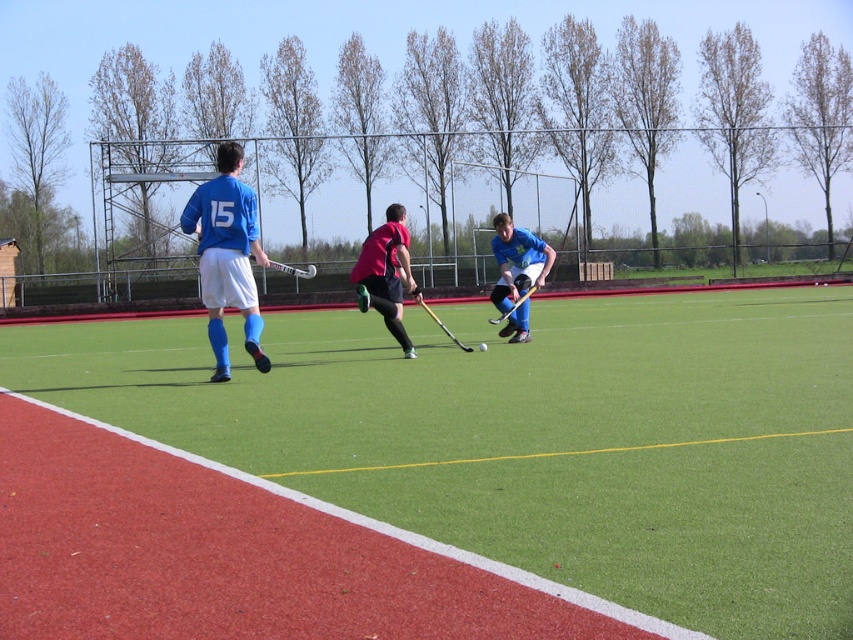
Question: Is matte blue jersey at left bigger than matte black hockey stick at center?

Choices:
 (A) no
 (B) yes

Answer: (B)

Question: Can you confirm if matte blue jersey at left is bigger than matte black hockey stick at center?

Choices:
 (A) no
 (B) yes

Answer: (B)

Question: Which of the following is the farthest from the observer?

Choices:
 (A) (310, 268)
 (B) (505, 317)

Answer: (B)

Question: Estimate the real-world distances between objects in this image. Which object is closer to the matte black hockey stick at center?

Choices:
 (A) matte blue jersey at left
 (B) green artificial turf at center

Answer: (A)

Question: Which of these objects is positioned farthest from the shiny red shorts at center?

Choices:
 (A) matte black hockey stick at center
 (B) wooden hockey stick at center

Answer: (A)

Question: Is green artificial turf at center above matte blue jersey at left?

Choices:
 (A) no
 (B) yes

Answer: (A)